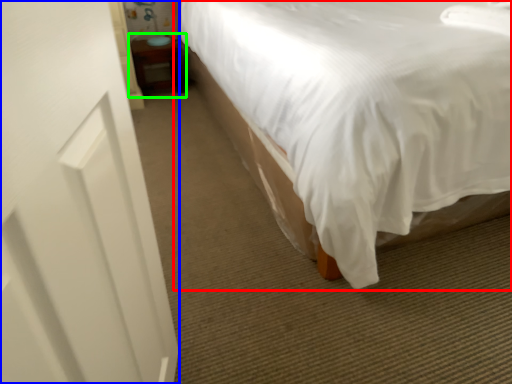
Question: Which object is positioned closest to bed (highlighted by a red box)? Select from screen door (highlighted by a blue box) and table (highlighted by a green box).

Choices:
 (A) screen door
 (B) table

Answer: (A)